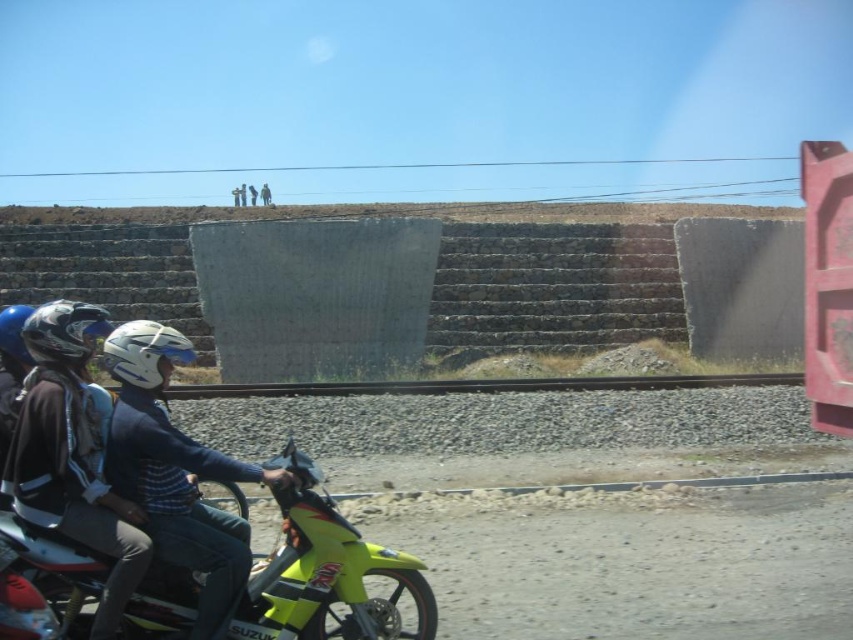
You are a photographer trying to capture both the white matte helmet at center and the blue matte helmet at left in a single frame. Which helmet should you adjust your camera angle to focus on first if you want to ensure both are in focus, considering their sizes?

The white matte helmet at center has a smaller width than the blue matte helmet at left. To ensure both are in focus, you should focus on the larger blue matte helmet at left first, as depth of field is more forgiving when focusing on larger objects closer to the camera.

You are a drone operator trying to capture the neon yellow plastic motorcycle at lower left. The drone is currently at the center of the image. Which direction should you move the drone to get closer to the motorcycle?

The neon yellow plastic motorcycle at lower left is located at point 0.895 on the x axis and 0.383 on the y axis. Since the drone is at the center of the image, which is point 0.5 on both axes, you should move the drone to the right and down to reach the motorcycle.

Based on the photo, you are a photographer trying to capture the neon yellow plastic motorcycle at lower left and the white matte helmet at center in a single frame. Based on their sizes in the image, which object would appear closer to the camera?

The white matte helmet at center appears closer to the camera because it is larger than the neon yellow plastic motorcycle at lower left.